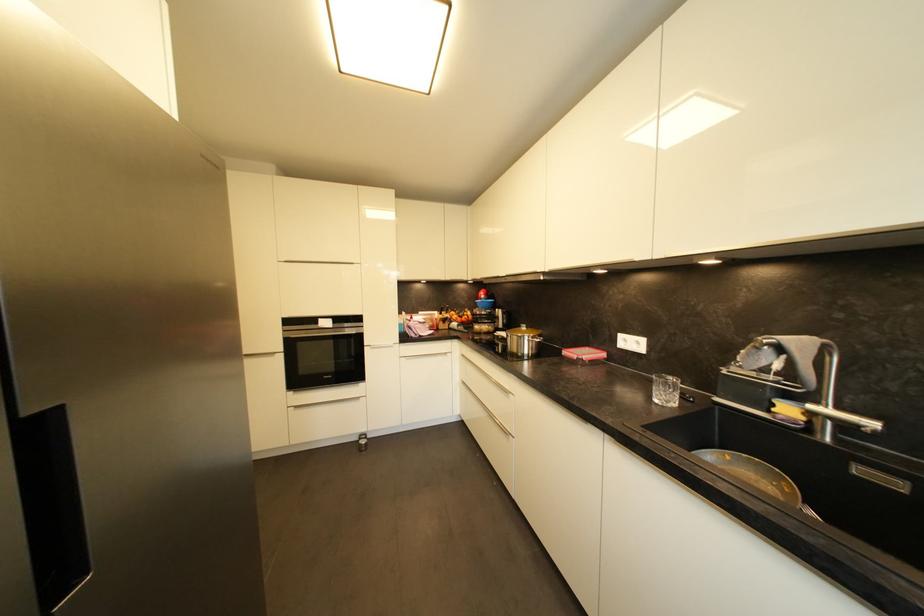
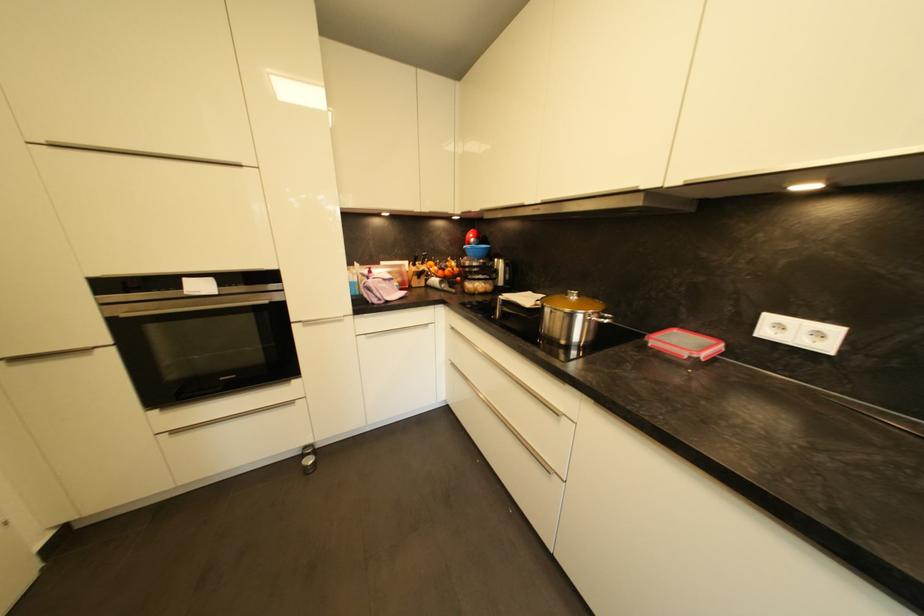
Question: The images are taken continuously from a first-person perspective. In which direction are you moving?

Choices:
 (A) Left
 (B) Right
 (C) Forward
 (D) Backward

Answer: (C)